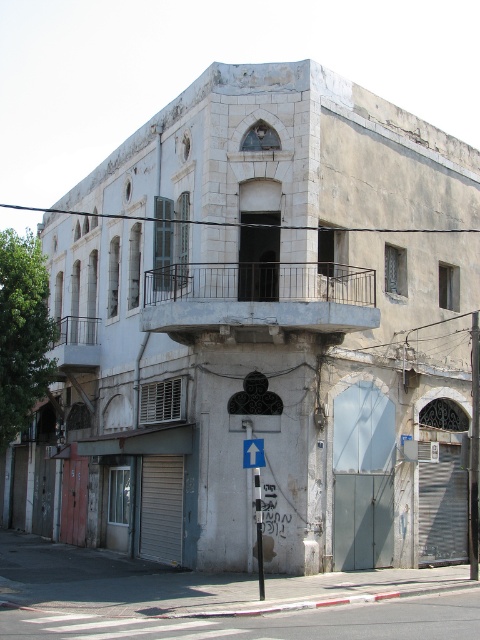
Question: Among these points, which one is farthest from the camera?

Choices:
 (A) (262, 458)
 (B) (358, 285)

Answer: (B)

Question: Can you confirm if white metal balcony at center is smaller than blue plastic sign at upper center?

Choices:
 (A) yes
 (B) no

Answer: (B)

Question: Can you confirm if white metal balcony at center is smaller than blue plastic sign at upper center?

Choices:
 (A) no
 (B) yes

Answer: (A)

Question: Can you confirm if white metal balcony at center is wider than blue plastic sign at upper center?

Choices:
 (A) yes
 (B) no

Answer: (A)

Question: Which of the following is the closest to the observer?

Choices:
 (A) white metal balcony at center
 (B) blue plastic sign at upper center

Answer: (B)